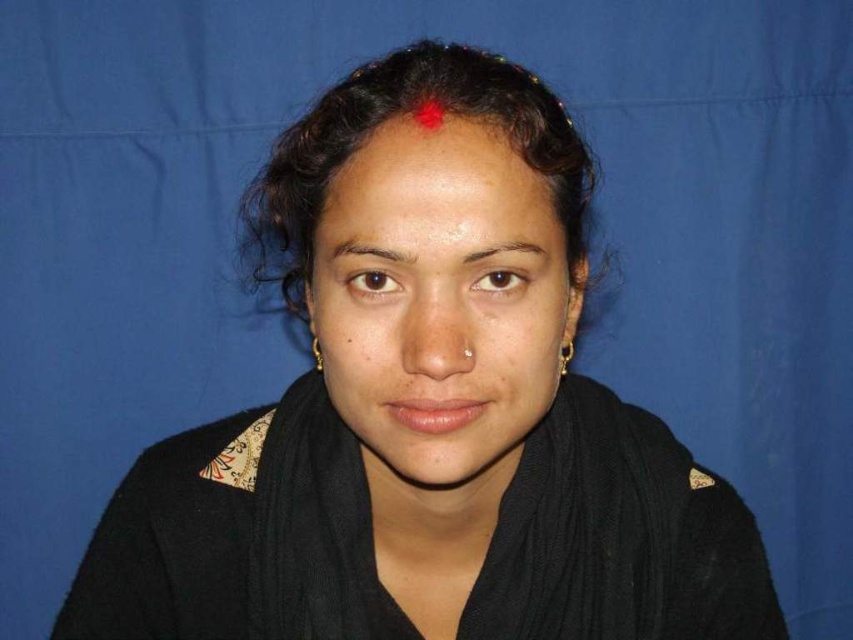
Question: In this image, where is black knitted scarf at center located relative to matte black hair at center?

Choices:
 (A) left
 (B) right

Answer: (B)

Question: Can you confirm if brown smooth eyebrow at upper center is bigger than brown matte eyebrow at center?

Choices:
 (A) yes
 (B) no

Answer: (B)

Question: Observing the image, what is the correct spatial positioning of matte skin forehead at center in reference to brown smooth eyebrow at upper center?

Choices:
 (A) below
 (B) above

Answer: (B)

Question: Which point is farther to the camera?

Choices:
 (A) (338, 252)
 (B) (666, 467)
 (C) (521, 253)

Answer: (B)

Question: Considering the real-world distances, which object is closest to the black knitted scarf at center?

Choices:
 (A) brown smooth eyebrow at upper center
 (B) brown matte eyebrow at center
 (C) matte black hair at center

Answer: (C)

Question: Which point is farther to the camera?

Choices:
 (A) brown smooth eyebrow at upper center
 (B) matte black hair at center
 (C) black knitted scarf at center

Answer: (C)